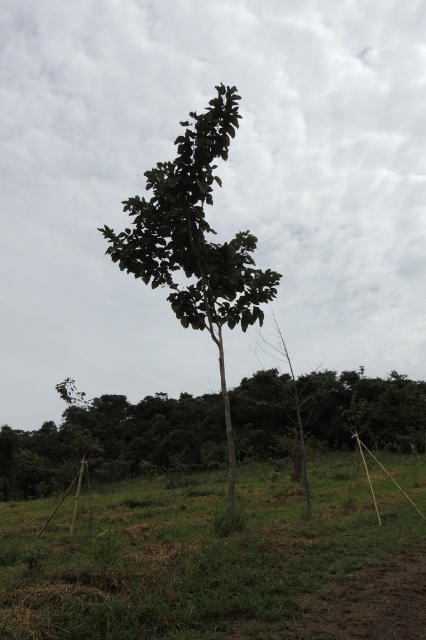
You are standing in the outdoor scene and want to walk from the green leafy tree at lower left to the green leafy tree at center. Which direction should you move to reach the tree at center?

To reach the green leafy tree at center from the green leafy tree at lower left, you should move forward because the green leafy tree at center is behind the green leafy tree at lower left.

You are standing at the edge of the scene and want to walk towards the green leafy tree at lower left. Which direction should you move relative to the green grass at center?

You should move to the right relative to the green grass at center because the green grass at center is to the left of the green leafy tree at lower left, meaning the tree is positioned to the right of the grass.